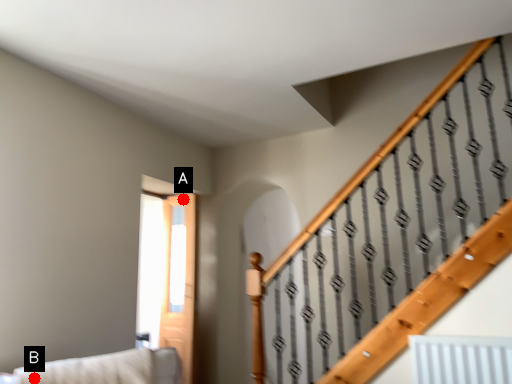
Question: Two points are circled on the image, labeled by A and B beside each circle. Which point appears farthest from the camera in this image?

Choices:
 (A) A is further
 (B) B is further

Answer: (A)